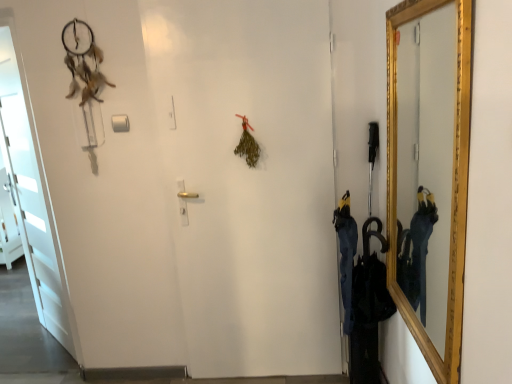
Question: Is point (14, 51) positioned closer to the camera than point (418, 314)?

Choices:
 (A) farther
 (B) closer

Answer: (A)

Question: Considering the positions of white matte door at left and gold-framed mirror at right in the image, is white matte door at left bigger or smaller than gold-framed mirror at right?

Choices:
 (A) small
 (B) big

Answer: (B)

Question: Considering the positions of white matte door at left and gold-framed mirror at right in the image, is white matte door at left taller or shorter than gold-framed mirror at right?

Choices:
 (A) short
 (B) tall

Answer: (B)

Question: Does point (407, 135) appear closer or farther from the camera than point (45, 246)?

Choices:
 (A) closer
 (B) farther

Answer: (A)

Question: From the image's perspective, is gold-framed mirror at right positioned above or below white matte door at left?

Choices:
 (A) above
 (B) below

Answer: (A)

Question: From a real-world perspective, is gold-framed mirror at right physically located above or below white matte door at left?

Choices:
 (A) below
 (B) above

Answer: (B)

Question: Considering their positions, is gold-framed mirror at right located in front of or behind white matte door at left?

Choices:
 (A) behind
 (B) front

Answer: (B)